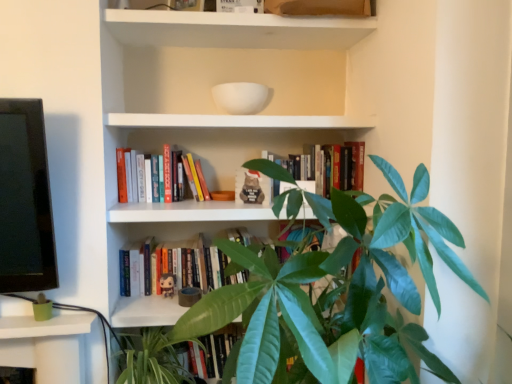
Question: Should I look upward or downward to see hardcover books at center, which is counted as the second book, starting from the top?

Choices:
 (A) down
 (B) up

Answer: (B)

Question: Is hardcover books at center, which is the 2th book in bottom-to-top order, looking in the opposite direction of hardcover books at center, acting as the first book starting from the top?

Choices:
 (A) no
 (B) yes

Answer: (A)

Question: Considering the relative sizes of hardcover books at center, which is the 2th book in bottom-to-top order, and hardcover books at center, acting as the first book starting from the top, in the image provided, is hardcover books at center, which is the 2th book in bottom-to-top order, smaller than hardcover books at center, acting as the first book starting from the top,?

Choices:
 (A) yes
 (B) no

Answer: (A)

Question: Is hardcover books at center, which is the 2th book in bottom-to-top order, positioned before hardcover books at center, acting as the first book starting from the top?

Choices:
 (A) no
 (B) yes

Answer: (A)

Question: Is hardcover books at center, which is the 2th book in bottom-to-top order, to the right of hardcover books at center, acting as the first book starting from the top, from the viewer's perspective?

Choices:
 (A) no
 (B) yes

Answer: (A)

Question: Can you confirm if hardcover books at center, which is counted as the second book, starting from the top, is taller than hardcover books at center, acting as the first book starting from the top?

Choices:
 (A) no
 (B) yes

Answer: (A)

Question: Is hardcover books at center, which is counted as the second book, starting from the top, not close to hardcover books at center, acting as the first book starting from the top?

Choices:
 (A) no
 (B) yes

Answer: (A)

Question: From a real-world perspective, is hardcover books at center, positioned as the 3th book in bottom-to-top order, beneath hardcover book at center, which is the 3th book from top to bottom?

Choices:
 (A) no
 (B) yes

Answer: (A)

Question: Is hardcover books at center, positioned as the 3th book in bottom-to-top order, in contact with hardcover book at center, which is the 1th book in bottom-to-top order?

Choices:
 (A) yes
 (B) no

Answer: (B)

Question: Does hardcover books at center, positioned as the 3th book in bottom-to-top order, have a larger size compared to hardcover book at center, which is the 1th book in bottom-to-top order?

Choices:
 (A) no
 (B) yes

Answer: (A)

Question: Is hardcover books at center, acting as the first book starting from the top, smaller than hardcover book at center, which is the 1th book in bottom-to-top order?

Choices:
 (A) yes
 (B) no

Answer: (A)

Question: Can you confirm if hardcover books at center, acting as the first book starting from the top, is wider than hardcover book at center, which is the 1th book in bottom-to-top order?

Choices:
 (A) yes
 (B) no

Answer: (A)

Question: Is hardcover books at center, acting as the first book starting from the top, shorter than hardcover book at center, which is the 1th book in bottom-to-top order?

Choices:
 (A) no
 (B) yes

Answer: (A)

Question: Is hardcover books at center, positioned as the 3th book in bottom-to-top order, positioned in front of hardcover books at center, which is the 2th book in bottom-to-top order?

Choices:
 (A) yes
 (B) no

Answer: (A)